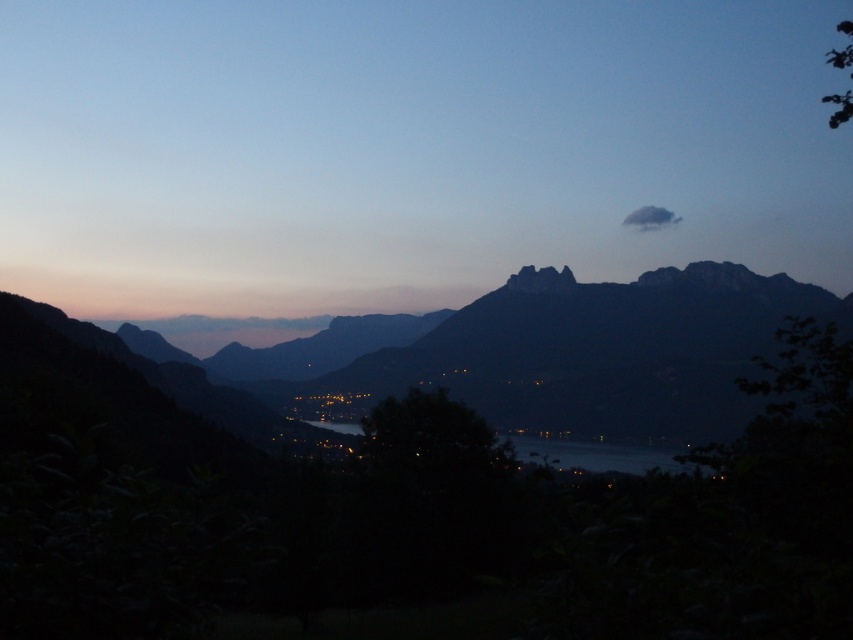
Based on the scene description, where is the point located at coordinates (543, 353)?

The point at coordinates (543, 353) is located on the dark gray rocky mountain range at center.

You are an observer standing in the foreground of the scene. You see the dark gray rocky mountain range at center and the glistening water at center. Which object is positioned to the left?

The dark gray rocky mountain range at center is positioned to the left of the glistening water at center.